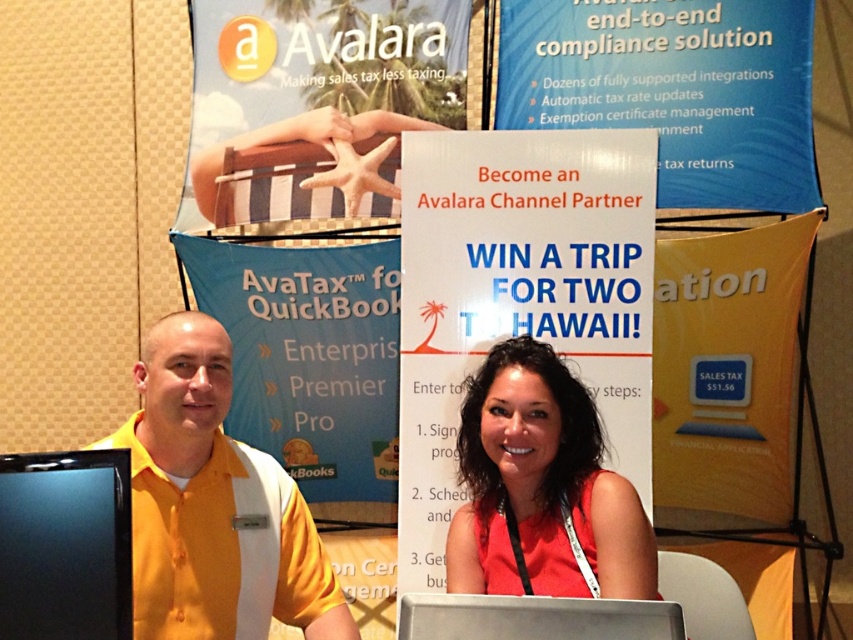
You are a photographer at the event and need to capture a clear photo of both the red satin dress at center and the silver metallic laptop at center. Based on their sizes, which object should you focus on first to ensure it appears in focus without needing to adjust the camera settings?

The red satin dress at center is much taller than the silver metallic laptop at center, so you should focus on the larger object first to ensure proper focus.

You are a photographer at the event and need to capture a photo of both the yellow shirt at center and the red satin dress at center. The camera you are using has a minimum focus distance of 20 inches. Can you take the photo without moving either person?

The yellow shirt at center and the red satin dress at center are 20.44 inches apart, which is slightly more than the camera minimum focus distance of 20 inches. Therefore, the photographer can take the photo without moving either person.